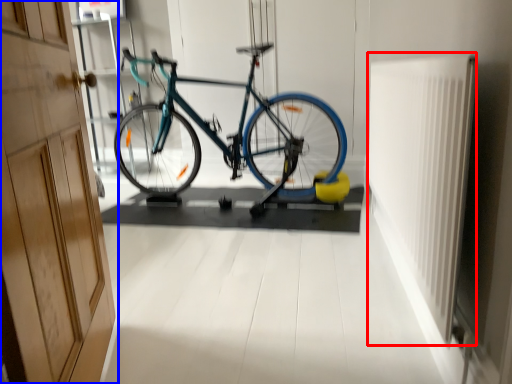
Question: Which object appears farthest to the camera in this image, radiator (highlighted by a red box) or door (highlighted by a blue box)?

Choices:
 (A) radiator
 (B) door

Answer: (A)